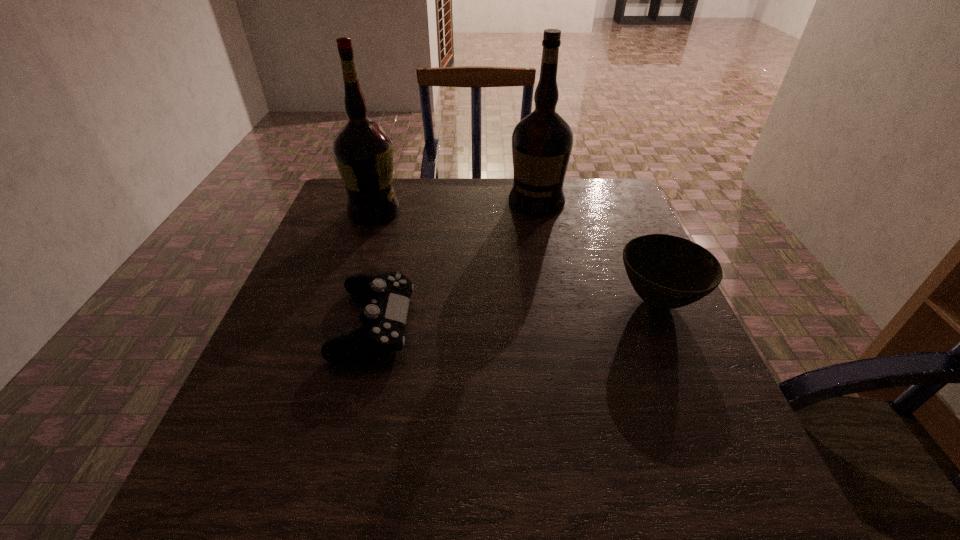
Where is `free spot on the desktop that is between the control and the third tallest object and is positioned on the surface of the liquor`? free spot on the desktop that is between the control and the third tallest object and is positioned on the surface of the liquor is located at coordinates (478, 315).

Image resolution: width=960 pixels, height=540 pixels. I want to click on vacant space on the desktop that is between the shortest object and the rightmost object and is positioned on the label of the alcohol, so click(547, 310).